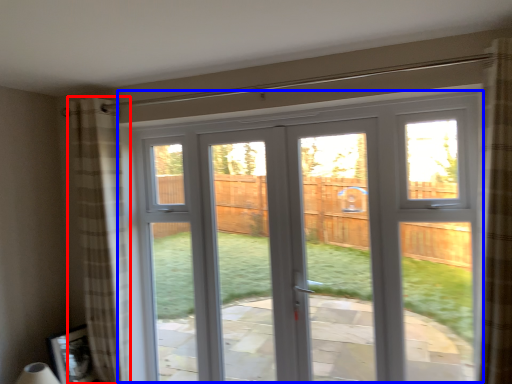
Question: Which of the following is the closest to the observer, curtain (highlighted by a red box) or window (highlighted by a blue box)?

Choices:
 (A) curtain
 (B) window

Answer: (B)